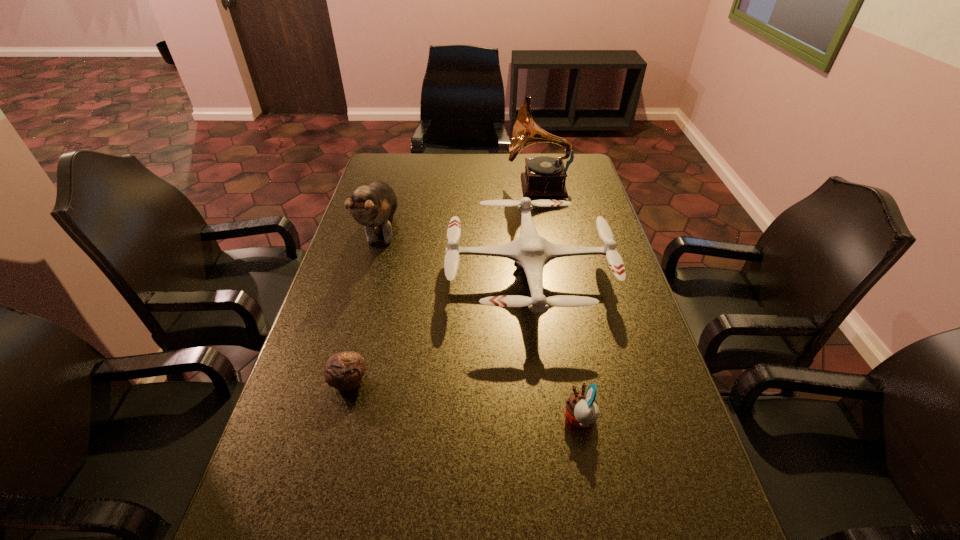
The height and width of the screenshot is (540, 960). I want to click on blank space located at the face of the cat, so click(345, 367).

This screenshot has height=540, width=960. Find the location of `free point located 0.300m with the camera attached at the bottom of the drone`. free point located 0.300m with the camera attached at the bottom of the drone is located at coordinates (346, 275).

Find the location of `free space located with the camera attached at the bottom of the drone`. free space located with the camera attached at the bottom of the drone is located at coordinates (332, 275).

Locate an element on the screen. free space located 0.280m with the camera attached at the bottom of the drone is located at coordinates (352, 275).

Where is `vacant space located on the front-facing side of the nearer muffin`? This screenshot has height=540, width=960. vacant space located on the front-facing side of the nearer muffin is located at coordinates (509, 418).

Identify the location of free space located 0.100m on the front-facing side of the nearer muffin. (518, 418).

Locate an element on the screen. free space located on the front-facing side of the nearer muffin is located at coordinates (463, 418).

Where is `vacant space located 0.200m on the back of the fourth farthest object`? The image size is (960, 540). vacant space located 0.200m on the back of the fourth farthest object is located at coordinates (369, 306).

I want to click on object situated at the far edge, so click(544, 176).

In order to click on cat located at the left edge in this screenshot , I will do `click(375, 204)`.